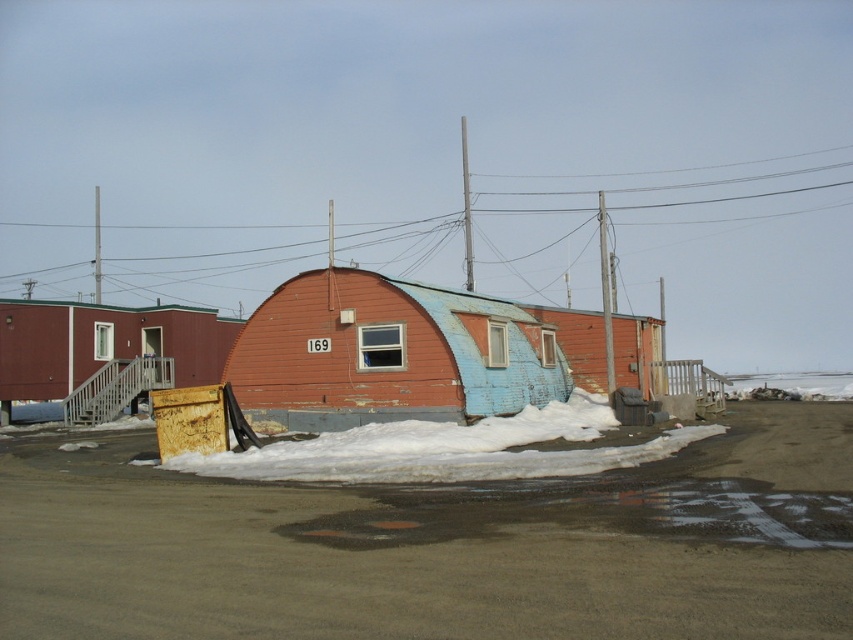
Is rusty corrugated metal hut at center to the right of rusty metal dumpster at left from the viewer's perspective?

Yes, rusty corrugated metal hut at center is to the right of rusty metal dumpster at left.

Does rusty corrugated metal hut at center have a larger size compared to rusty metal dumpster at left?

Incorrect, rusty corrugated metal hut at center is not larger than rusty metal dumpster at left.

What do you see at coordinates (398, 353) in the screenshot?
I see `rusty corrugated metal hut at center` at bounding box center [398, 353].

At what (x,y) coordinates should I click in order to perform the action: click on rusty corrugated metal hut at center. Please return your answer as a coordinate pair (x, y). Looking at the image, I should click on (398, 353).

Does rusty metal dumpster at left lie behind metallic wire at upper center?

That is False.

Who is more forward, (213,333) or (706,182)?

Point (213,333)

I want to click on rusty metal dumpster at left, so click(x=102, y=344).

Is white powdery snow at center closer to the viewer compared to rusty metal dumpster at left?

Yes, white powdery snow at center is closer to the viewer.

Between point (229, 451) and point (84, 378), which one is positioned in front?

Point (229, 451)

Is point (508, 470) positioned before point (47, 320)?

Yes.

Find the location of a particular element. This screenshot has width=853, height=640. white powdery snow at center is located at coordinates (448, 449).